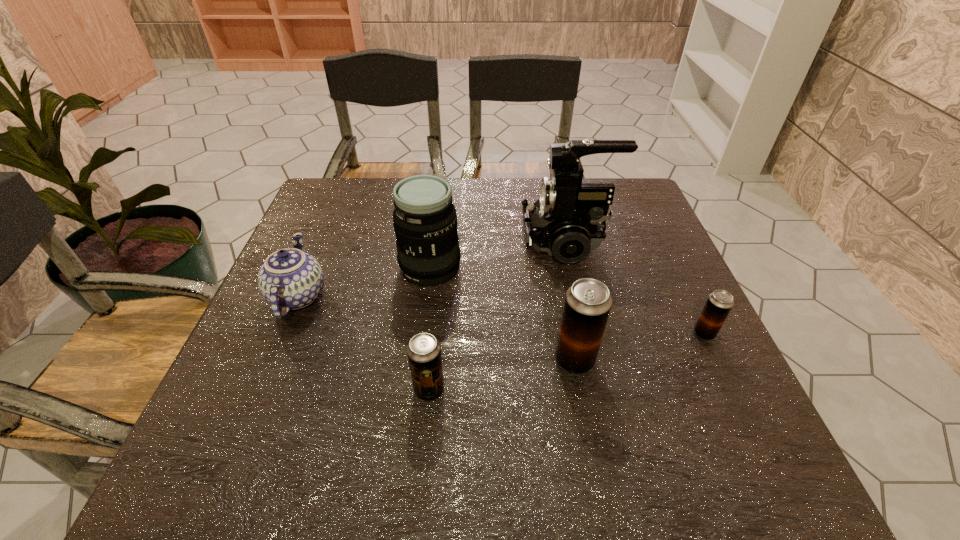
Locate an element on the screen. the leftmost beer can is located at coordinates (424, 351).

The image size is (960, 540). In order to click on the nearest beer can in this screenshot , I will do `click(424, 351)`.

Locate an element on the screen. This screenshot has width=960, height=540. the third tallest object is located at coordinates (587, 305).

Where is `the tallest beer can`? the tallest beer can is located at coordinates (587, 305).

Where is `the farthest beer can`? The image size is (960, 540). the farthest beer can is located at coordinates (719, 303).

Locate an element on the screen. Image resolution: width=960 pixels, height=540 pixels. the shortest object is located at coordinates (719, 303).

Locate an element on the screen. the tallest object is located at coordinates click(x=567, y=221).

Where is `telephoto lens`? telephoto lens is located at coordinates (425, 222).

You are a GUI agent. You are given a task and a screenshot of the screen. Output one action in this format:
    pyautogui.click(x=<x>, y=<y>)
    Task: Click on the leftmost object
    This screenshot has height=540, width=960.
    Given the screenshot: What is the action you would take?
    pyautogui.click(x=291, y=279)

In order to click on free space located on the right of the nearest object in this screenshot , I will do `click(492, 390)`.